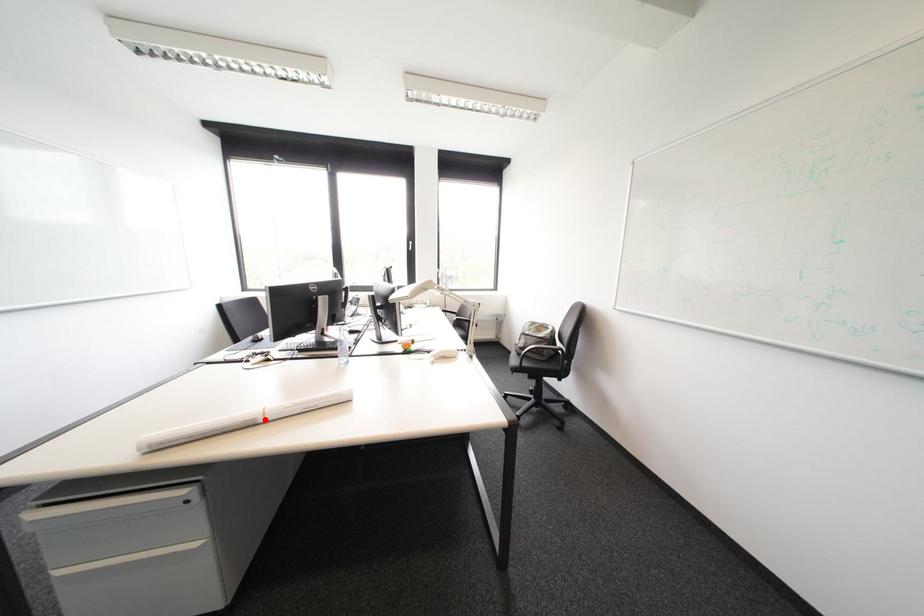
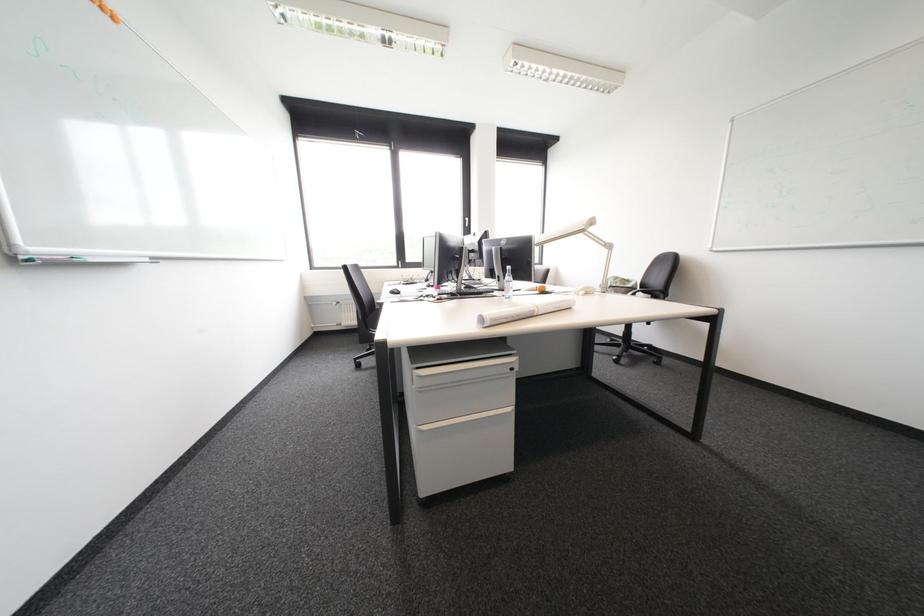
Question: I am providing you with two images of the same scene from different viewpoints. A red point is marked on the first image. Can you still see the location of the red point in image 2?

Choices:
 (A) Yes
 (B) No

Answer: (A)